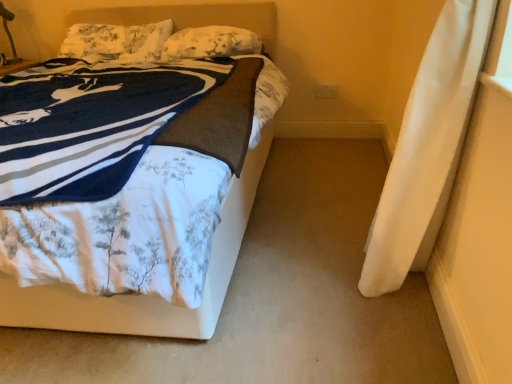
Question: Considering the relative sizes of fluffy white pillow at upper center, arranged as the 2th pillow when viewed from the left, and metallic gold table lamp at upper left in the image provided, is fluffy white pillow at upper center, arranged as the 2th pillow when viewed from the left, taller than metallic gold table lamp at upper left?

Choices:
 (A) no
 (B) yes

Answer: (A)

Question: Considering the relative positions of fluffy white pillow at upper center, arranged as the 2th pillow when viewed from the left, and metallic gold table lamp at upper left in the image provided, is fluffy white pillow at upper center, arranged as the 2th pillow when viewed from the left, to the left of metallic gold table lamp at upper left from the viewer's perspective?

Choices:
 (A) yes
 (B) no

Answer: (B)

Question: From the image's perspective, is fluffy white pillow at upper center, placed as the 1th pillow when sorted from right to left, above metallic gold table lamp at upper left?

Choices:
 (A) yes
 (B) no

Answer: (B)

Question: Considering the relative sizes of fluffy white pillow at upper center, arranged as the 2th pillow when viewed from the left, and metallic gold table lamp at upper left in the image provided, is fluffy white pillow at upper center, arranged as the 2th pillow when viewed from the left, bigger than metallic gold table lamp at upper left?

Choices:
 (A) yes
 (B) no

Answer: (A)

Question: Is fluffy white pillow at upper center, placed as the 1th pillow when sorted from right to left, outside of metallic gold table lamp at upper left?

Choices:
 (A) no
 (B) yes

Answer: (B)

Question: From a real-world perspective, is fluffy white pillow at upper left, which ranks as the first pillow in left-to-right order, above or below white floral fabric bed at upper left?

Choices:
 (A) below
 (B) above

Answer: (B)

Question: Is fluffy white pillow at upper left, which ranks as the 2th pillow in right-to-left order, taller or shorter than white floral fabric bed at upper left?

Choices:
 (A) tall
 (B) short

Answer: (B)

Question: Is fluffy white pillow at upper left, which ranks as the 2th pillow in right-to-left order, bigger or smaller than white floral fabric bed at upper left?

Choices:
 (A) big
 (B) small

Answer: (B)

Question: Is fluffy white pillow at upper left, which ranks as the first pillow in left-to-right order, to the left or to the right of white floral fabric bed at upper left in the image?

Choices:
 (A) left
 (B) right

Answer: (A)

Question: In terms of size, does fluffy white pillow at upper left, which ranks as the first pillow in left-to-right order, appear bigger or smaller than fluffy white pillow at upper center, placed as the 1th pillow when sorted from right to left?

Choices:
 (A) small
 (B) big

Answer: (B)

Question: Choose the correct answer: Is fluffy white pillow at upper left, which ranks as the 2th pillow in right-to-left order, inside fluffy white pillow at upper center, arranged as the 2th pillow when viewed from the left, or outside it?

Choices:
 (A) inside
 (B) outside

Answer: (B)

Question: Considering the positions of fluffy white pillow at upper left, which ranks as the 2th pillow in right-to-left order, and fluffy white pillow at upper center, arranged as the 2th pillow when viewed from the left, in the image, is fluffy white pillow at upper left, which ranks as the 2th pillow in right-to-left order, taller or shorter than fluffy white pillow at upper center, arranged as the 2th pillow when viewed from the left,?

Choices:
 (A) tall
 (B) short

Answer: (A)

Question: Considering the positions of point (117, 26) and point (177, 56), is point (117, 26) closer or farther from the camera than point (177, 56)?

Choices:
 (A) farther
 (B) closer

Answer: (A)

Question: Considering the positions of fluffy white pillow at upper center, arranged as the 2th pillow when viewed from the left, and metallic gold table lamp at upper left in the image, is fluffy white pillow at upper center, arranged as the 2th pillow when viewed from the left, taller or shorter than metallic gold table lamp at upper left?

Choices:
 (A) short
 (B) tall

Answer: (A)

Question: Which is correct: fluffy white pillow at upper center, placed as the 1th pillow when sorted from right to left, is inside metallic gold table lamp at upper left, or outside of it?

Choices:
 (A) outside
 (B) inside

Answer: (A)